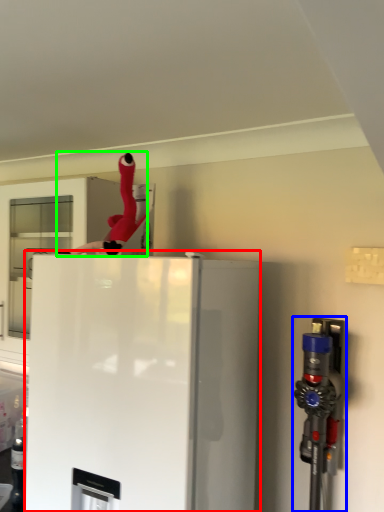
Question: Estimate the real-world distances between objects in this image. Which object is farther from refrigerator (highlighted by a red box), appliance (highlighted by a blue box) or person (highlighted by a green box)?

Choices:
 (A) appliance
 (B) person

Answer: (B)